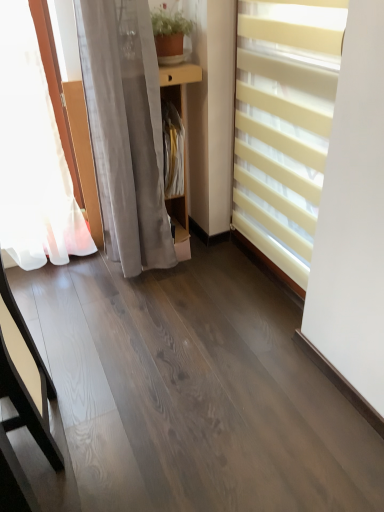
Question: From the image's perspective, relative to sheer white curtain at left, is matte yellow blinds at right above or below?

Choices:
 (A) above
 (B) below

Answer: (B)

Question: Is matte yellow blinds at right wider or thinner than sheer white curtain at left?

Choices:
 (A) thin
 (B) wide

Answer: (A)

Question: Which object is positioned farthest from the light brown wood table at left?

Choices:
 (A) wooden shelf at center
 (B) matte yellow blinds at right
 (C) sheer white curtain at left

Answer: (A)

Question: Considering the real-world distances, which object is farthest from the sheer white curtain at left?

Choices:
 (A) light brown wood table at left
 (B) matte yellow blinds at right
 (C) wooden shelf at center

Answer: (A)